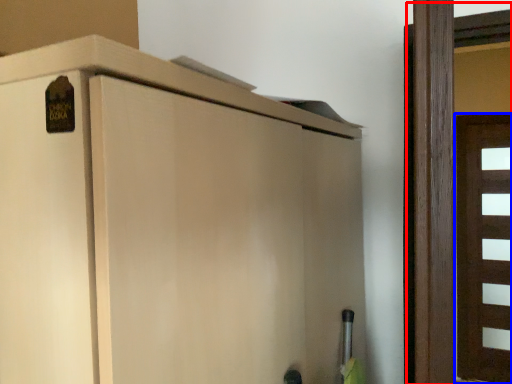
Question: Which object appears closest to the camera in this image, door (highlighted by a red box) or door (highlighted by a blue box)?

Choices:
 (A) door
 (B) door

Answer: (A)